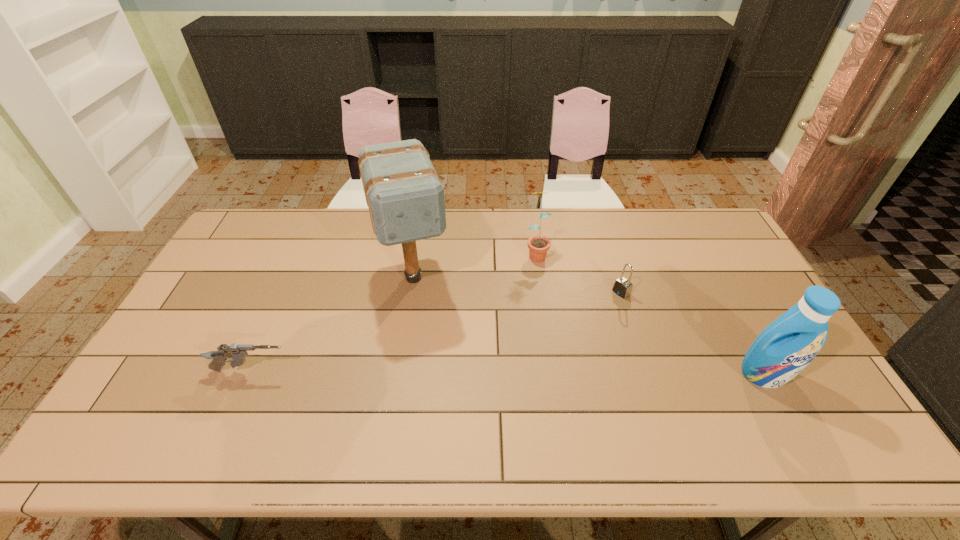
You are a GUI agent. You are given a task and a screenshot of the screen. Output one action in this format:
    pyautogui.click(x=<x>, y=<y>)
    Task: Click on the vacant point located between the padlock and the sunflower
    This screenshot has width=960, height=540.
    Given the screenshot: What is the action you would take?
    pyautogui.click(x=578, y=273)

Find the location of `unoccupied position between the third object from right to left and the fourth object from right to left`. unoccupied position between the third object from right to left and the fourth object from right to left is located at coordinates coord(474,265).

Where is `empty location between the tallest object and the gun`? empty location between the tallest object and the gun is located at coordinates click(x=333, y=324).

Find the location of a particular element. Image resolution: width=960 pixels, height=540 pixels. blank region between the third tallest object and the second tallest object is located at coordinates (650, 314).

Image resolution: width=960 pixels, height=540 pixels. Find the location of `empty space that is in between the sunflower and the second object from right to left`. empty space that is in between the sunflower and the second object from right to left is located at coordinates (578, 273).

The width and height of the screenshot is (960, 540). I want to click on vacant point located between the leftmost object and the rightmost object, so click(x=508, y=373).

Where is `free space between the fourth object from left to right and the mallet`? The image size is (960, 540). free space between the fourth object from left to right and the mallet is located at coordinates (517, 285).

Where is `free space between the third object from right to left and the second object from left to right`? The height and width of the screenshot is (540, 960). free space between the third object from right to left and the second object from left to right is located at coordinates (474, 265).

Image resolution: width=960 pixels, height=540 pixels. I want to click on free space that is in between the rightmost object and the padlock, so click(693, 334).

In order to click on object that is the second nearest to the leftmost object in this screenshot , I will do `click(538, 245)`.